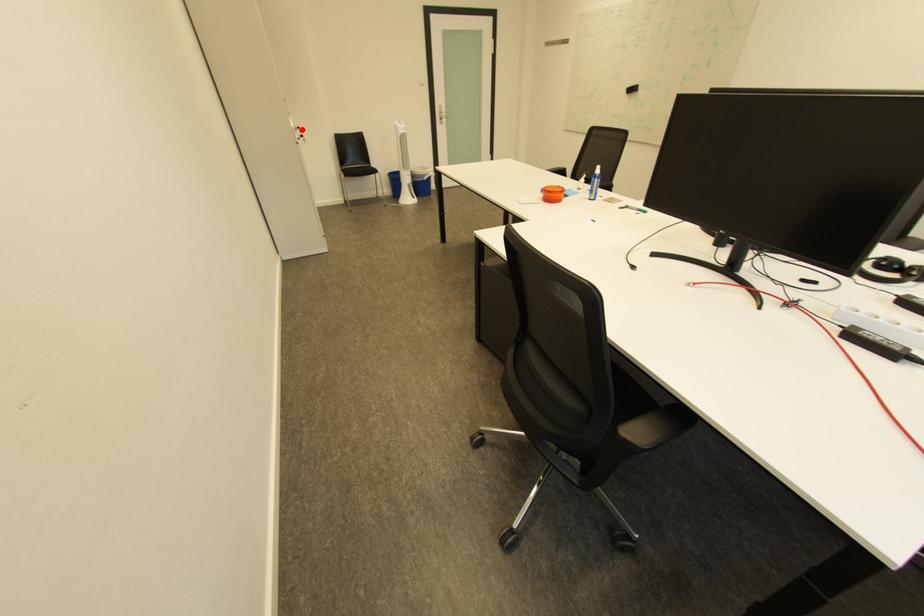
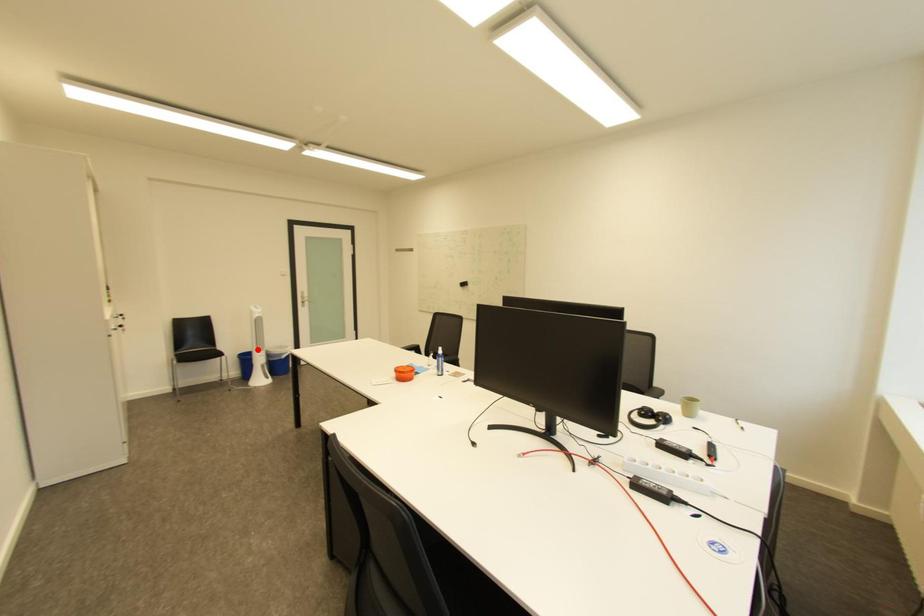
Consider the image. I am providing you with two images of the same scene from different viewpoints. A red point is marked on the first image and another point is marked on the second image. Is the red point in image1 aligned with the point shown in image2?

No